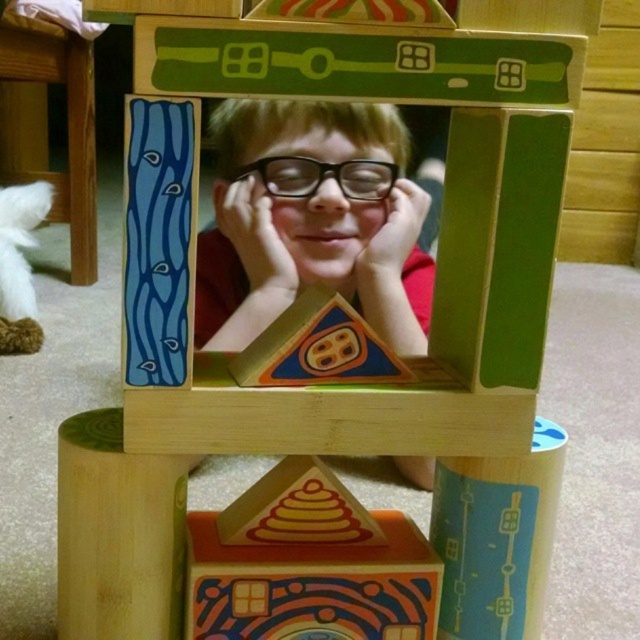
You are a toy designer trying to create a new accessory for the child in the scene. You need to know if the matte black glasses at center can fit on a stand designed for the wooden stool at lower left. Can they?

The matte black glasses at center has a width less than the wooden stool at lower left, so they can fit on the stand designed for the wooden stool at lower left.

You are a photographer trying to capture the child through the window frame. You notice the matte black glasses at center and the wooden stool at lower left in your viewfinder. Which object is closer to the camera?

The matte black glasses at center is closer to the camera because it is in front of the wooden stool at lower left.

You are a toy designer observing the scene. You need to decide which object, the matte black glasses at center or the wooden stool at lower left, requires a larger storage compartment in your new toy set. Which one do you choose?

The wooden stool at lower left requires a larger storage compartment because it is bigger than the matte black glasses at center.